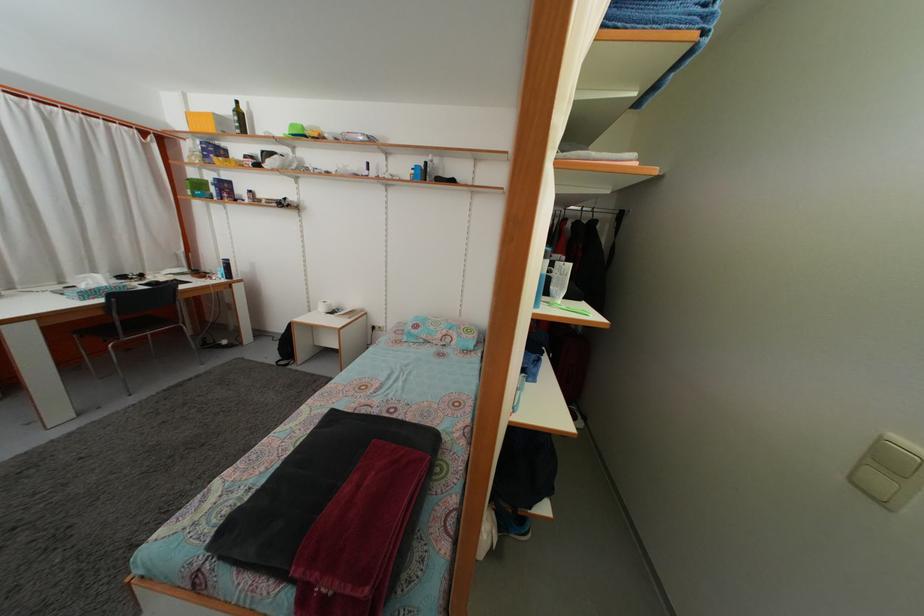
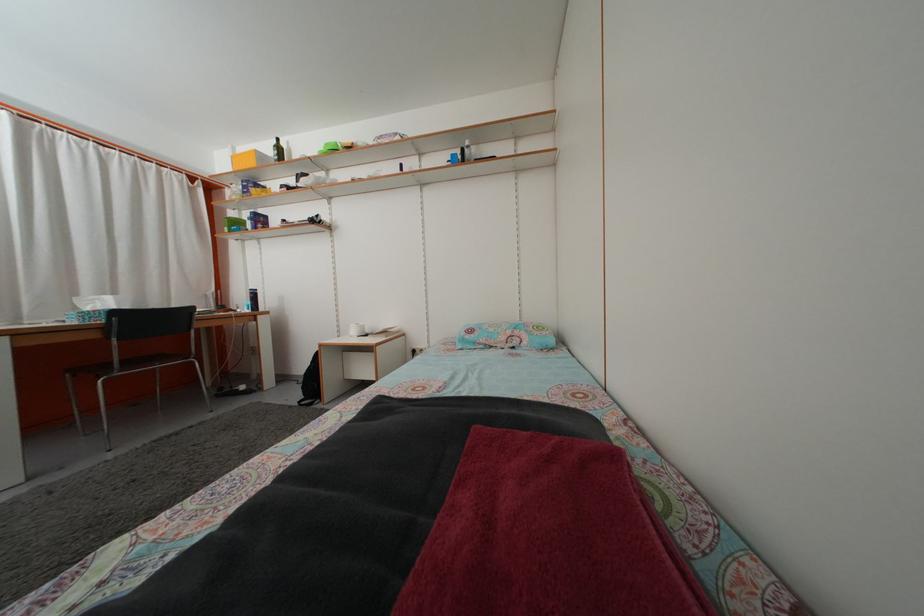
The point at (238, 113) is marked in the first image. Where is the corresponding point in the second image?

(281, 148)